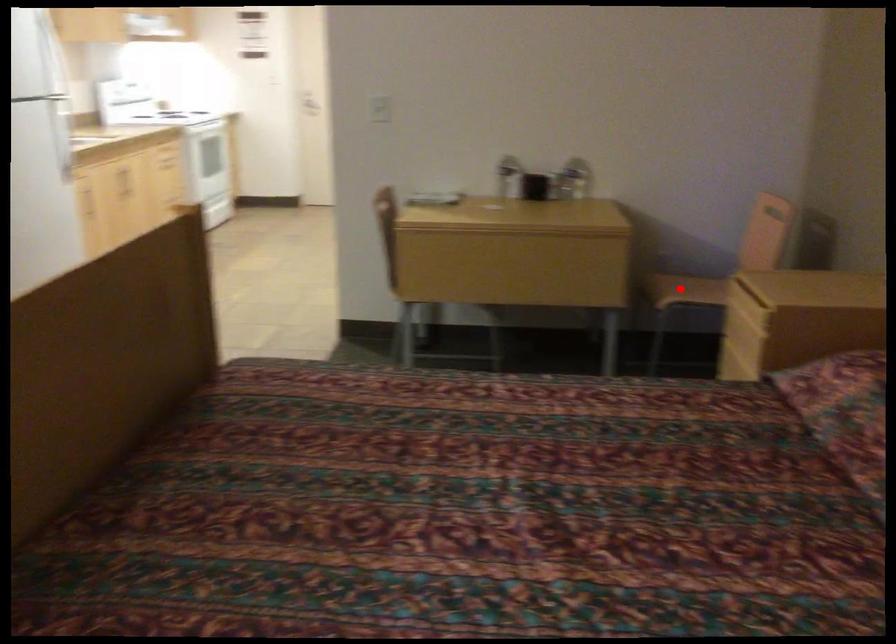
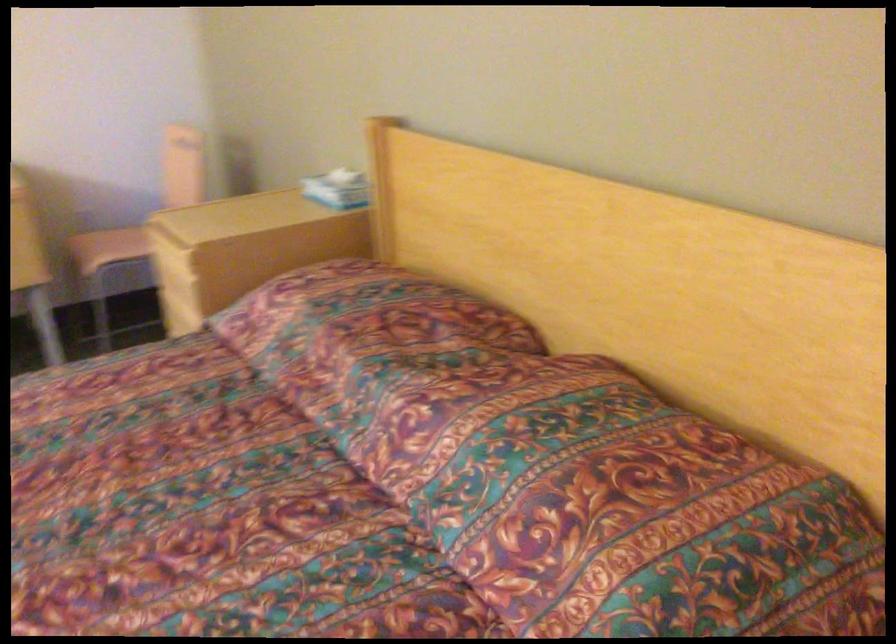
The point at the highlighted location is marked in the first image. Where is the corresponding point in the second image?

(108, 247)